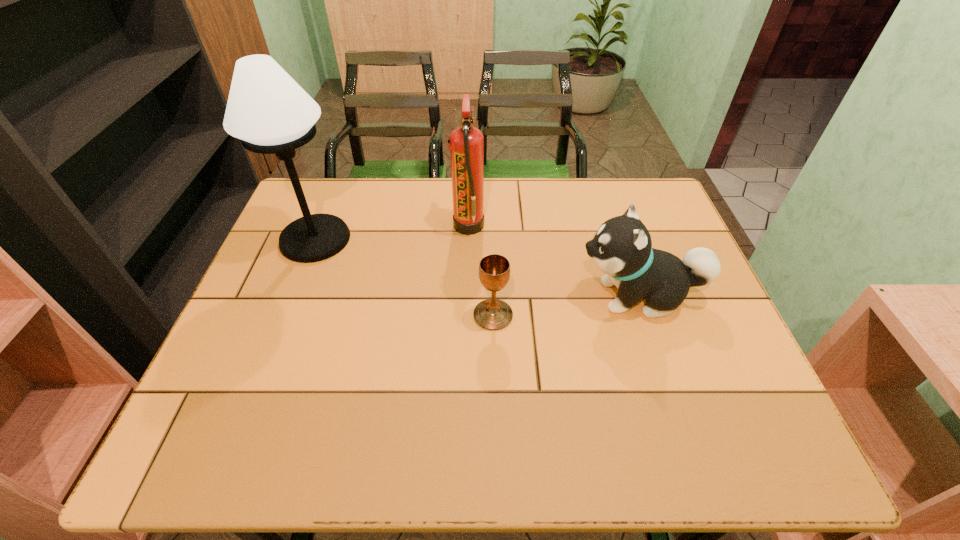
Where is `vacant space that is in between the rightmost object and the table lamp`? The width and height of the screenshot is (960, 540). vacant space that is in between the rightmost object and the table lamp is located at coordinates (477, 268).

You are a GUI agent. You are given a task and a screenshot of the screen. Output one action in this format:
    pyautogui.click(x=<x>, y=<y>)
    Task: Click on the free spot between the shortest object and the rightmost object
    Image resolution: width=960 pixels, height=540 pixels.
    Given the screenshot: What is the action you would take?
    pyautogui.click(x=566, y=306)

The height and width of the screenshot is (540, 960). What are the coordinates of `the second closest object to the fire extinguisher` in the screenshot? It's located at (622, 248).

Identify which object is the second nearest to the third tallest object. Please provide its 2D coordinates. Your answer should be formatted as a tuple, i.e. [(x, y)], where the tuple contains the x and y coordinates of a point satisfying the conditions above.

[(466, 146)]

The height and width of the screenshot is (540, 960). What are the coordinates of `free space in the image that satisfies the following two spatial constraints: 1. with the nozzle pointing from the back of the chalice; 2. on the left side of the fire extinguisher` in the screenshot? It's located at tap(466, 315).

The width and height of the screenshot is (960, 540). I want to click on free space that satisfies the following two spatial constraints: 1. with the nozzle pointing from the back of the fire extinguisher; 2. on the front side of the tallest object, so click(468, 239).